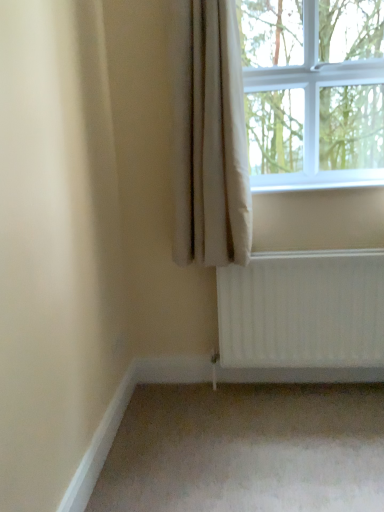
You are a GUI agent. You are given a task and a screenshot of the screen. Output one action in this format:
    pyautogui.click(x=<x>, y=<y>)
    Task: Click on the beige fabric curtain at upper right
    The image size is (384, 512).
    Given the screenshot: What is the action you would take?
    pyautogui.click(x=209, y=136)

Describe the element at coordinates (209, 136) in the screenshot. I see `beige fabric curtain at upper right` at that location.

Locate an element on the screen. Image resolution: width=384 pixels, height=512 pixels. clear glass window at upper right is located at coordinates (313, 92).

Measure the distance between clear glass window at upper right and camera.

clear glass window at upper right and camera are 1.98 meters apart.

In order to face clear glass window at upper right, should I rotate leftwards or rightwards?

To align with it, rotate right about 16.616°.

The width and height of the screenshot is (384, 512). What do you see at coordinates (313, 92) in the screenshot?
I see `clear glass window at upper right` at bounding box center [313, 92].

Where is `beige fabric curtain at upper right`? Image resolution: width=384 pixels, height=512 pixels. beige fabric curtain at upper right is located at coordinates (209, 136).

Considering the positions of objects clear glass window at upper right and beige fabric curtain at upper right in the image provided, who is more to the left, clear glass window at upper right or beige fabric curtain at upper right?

beige fabric curtain at upper right is more to the left.

Relative to beige fabric curtain at upper right, is clear glass window at upper right in front or behind?

clear glass window at upper right is positioned farther from the viewer than beige fabric curtain at upper right.

Which is less distant, (298, 15) or (181, 32)?

Point (298, 15).

From the image's perspective, is clear glass window at upper right on beige fabric curtain at upper right?

Correct, clear glass window at upper right appears higher than beige fabric curtain at upper right in the image.

From a real-world perspective, between clear glass window at upper right and beige fabric curtain at upper right, who is vertically lower?

beige fabric curtain at upper right, from a real-world perspective.

Between clear glass window at upper right and beige fabric curtain at upper right, which one has smaller width?

Thinner between the two is beige fabric curtain at upper right.

Considering the sizes of objects clear glass window at upper right and beige fabric curtain at upper right in the image provided, who is shorter, clear glass window at upper right or beige fabric curtain at upper right?

With less height is clear glass window at upper right.

Who is bigger, clear glass window at upper right or beige fabric curtain at upper right?

clear glass window at upper right.

Choose the correct answer: Is clear glass window at upper right inside beige fabric curtain at upper right or outside it?

clear glass window at upper right is not enclosed by beige fabric curtain at upper right.

Is clear glass window at upper right in contact with beige fabric curtain at upper right?

No, clear glass window at upper right is not in contact with beige fabric curtain at upper right.

Is beige fabric curtain at upper right at the back of clear glass window at upper right?

No.

This screenshot has height=512, width=384. I want to click on curtain below the clear glass window at upper right (from the image's perspective), so click(209, 136).

Is beige fabric curtain at upper right to the left of clear glass window at upper right from the viewer's perspective?

Indeed, beige fabric curtain at upper right is positioned on the left side of clear glass window at upper right.

Is the depth of beige fabric curtain at upper right less than that of clear glass window at upper right?

Yes.

Does point (216, 104) come closer to viewer compared to point (268, 46)?

Yes, point (216, 104) is closer to viewer.

From the image's perspective, relative to clear glass window at upper right, is beige fabric curtain at upper right above or below?

beige fabric curtain at upper right is below clear glass window at upper right.

From a real-world perspective, who is located higher, beige fabric curtain at upper right or clear glass window at upper right?

From a 3D spatial view, clear glass window at upper right is above.

Looking at this image, considering the relative sizes of beige fabric curtain at upper right and clear glass window at upper right in the image provided, is beige fabric curtain at upper right wider than clear glass window at upper right?

No, beige fabric curtain at upper right is not wider than clear glass window at upper right.

Looking at this image, which of these two, beige fabric curtain at upper right or clear glass window at upper right, stands taller?

Standing taller between the two is beige fabric curtain at upper right.

Which of these two, beige fabric curtain at upper right or clear glass window at upper right, is bigger?

Bigger between the two is clear glass window at upper right.

Is beige fabric curtain at upper right located outside clear glass window at upper right?

Yes.

Consider the image. Is beige fabric curtain at upper right next to clear glass window at upper right?

Answer: No.

Is beige fabric curtain at upper right turned away from clear glass window at upper right?

No, clear glass window at upper right is not at the back of beige fabric curtain at upper right.

How different are the orientations of beige fabric curtain at upper right and clear glass window at upper right in degrees?

beige fabric curtain at upper right and clear glass window at upper right are facing 0.00734 degrees away from each other.

The width and height of the screenshot is (384, 512). I want to click on window above the beige fabric curtain at upper right (from a real-world perspective), so click(x=313, y=92).

Image resolution: width=384 pixels, height=512 pixels. Identify the location of curtain below the clear glass window at upper right (from the image's perspective). (209, 136).

What are the coordinates of `curtain that is under the clear glass window at upper right (from a real-world perspective)` in the screenshot? It's located at (209, 136).